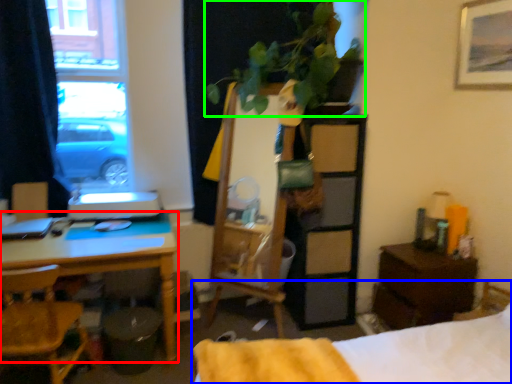
Question: Which object is positioned closest to desk (highlighted by a red box)? Select from bed (highlighted by a blue box) and houseplant (highlighted by a green box).

Choices:
 (A) bed
 (B) houseplant

Answer: (A)